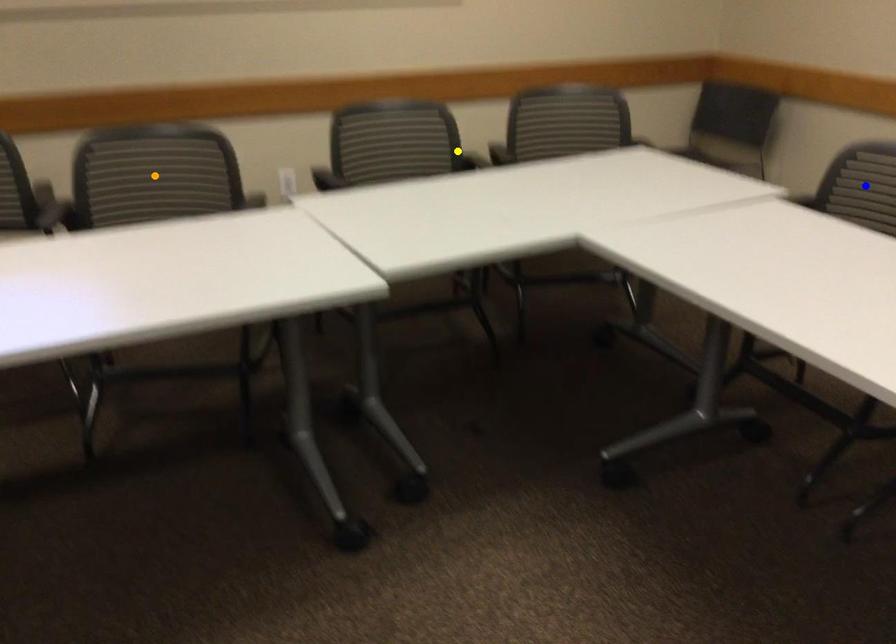
Looking at this image, order these from nearest to farthest:
A) orange point
B) blue point
C) yellow point

blue point < orange point < yellow point